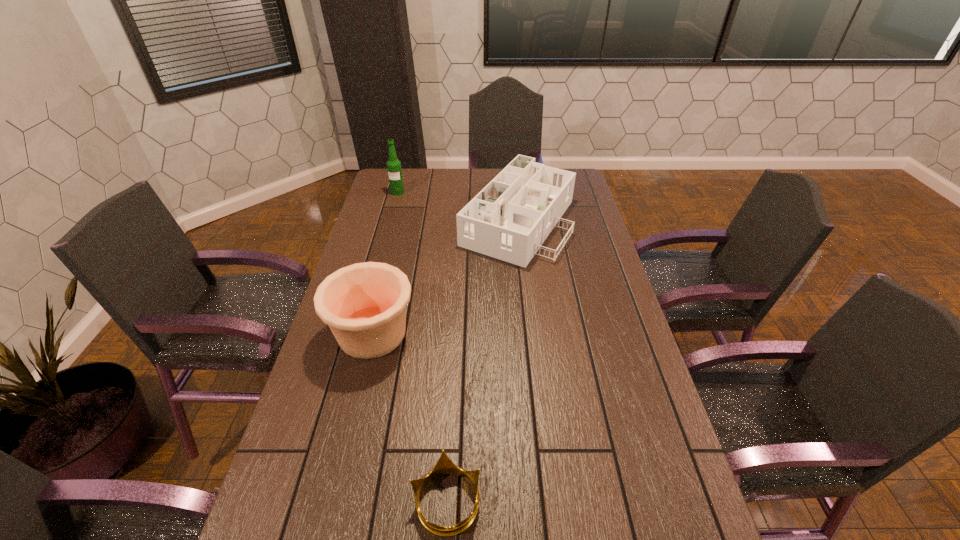
Find the location of a particular element. This screenshot has width=960, height=540. beer bottle that is at the far edge is located at coordinates (394, 169).

Find the location of a particular element. dollhouse present at the far edge is located at coordinates pos(509,219).

Image resolution: width=960 pixels, height=540 pixels. I want to click on beer bottle present at the left edge, so [394, 169].

What are the coordinates of `pottery that is at the left edge` in the screenshot? It's located at (364, 304).

Image resolution: width=960 pixels, height=540 pixels. Find the location of `object that is at the right edge`. object that is at the right edge is located at coordinates (509, 219).

Find the location of `object positioned at the far left corner`. object positioned at the far left corner is located at coordinates (394, 169).

At what (x,y) coordinates should I click in order to perform the action: click on object located in the far right corner section of the desktop. Please return your answer as a coordinate pair (x, y). Looking at the image, I should click on (509, 219).

At what (x,y) coordinates should I click in order to perform the action: click on vacant region at the far edge of the desktop. Please return your answer as a coordinate pair (x, y). The width and height of the screenshot is (960, 540). Looking at the image, I should click on click(x=453, y=184).

Locate an element on the screen. This screenshot has width=960, height=540. free spot at the left edge of the desktop is located at coordinates (391, 214).

In the image, there is a desktop. At what (x,y) coordinates should I click in order to perform the action: click on vacant space at the right edge. Please return your answer as a coordinate pair (x, y). This screenshot has height=540, width=960. Looking at the image, I should click on pos(628,357).